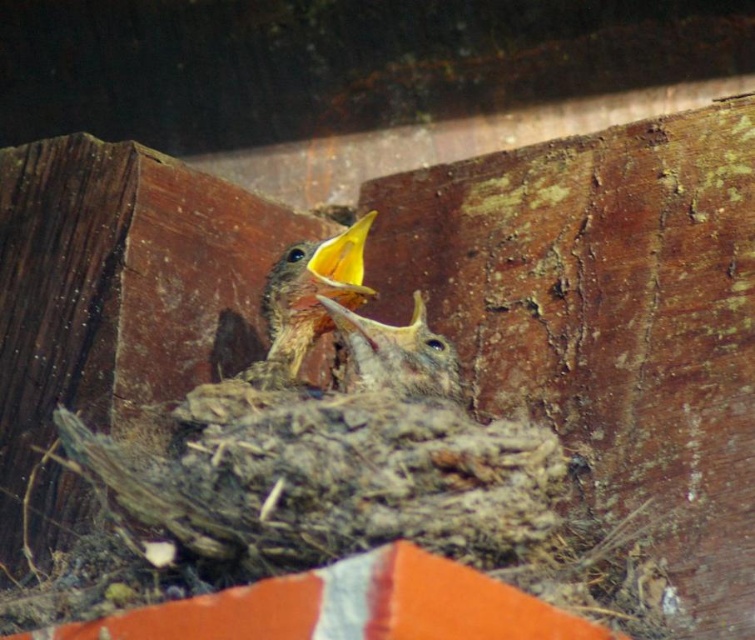
Question: Which point is farther from the camera taking this photo?

Choices:
 (A) (267, 317)
 (B) (344, 284)
 (C) (450, 380)

Answer: (A)

Question: Is brown speckled feathers at center thinner than smooth brown bird at center?

Choices:
 (A) no
 (B) yes

Answer: (B)

Question: Which point appears closest to the camera in this image?

Choices:
 (A) (373, 369)
 (B) (353, 230)

Answer: (A)

Question: Is smooth brown bird at center behind yellow matte beak at center?

Choices:
 (A) yes
 (B) no

Answer: (B)

Question: Which point is farther from the camera taking this photo?

Choices:
 (A) (387, 362)
 (B) (362, 269)

Answer: (B)

Question: Where is brown speckled feathers at center located in relation to yellow matte beak at center in the image?

Choices:
 (A) left
 (B) right

Answer: (A)